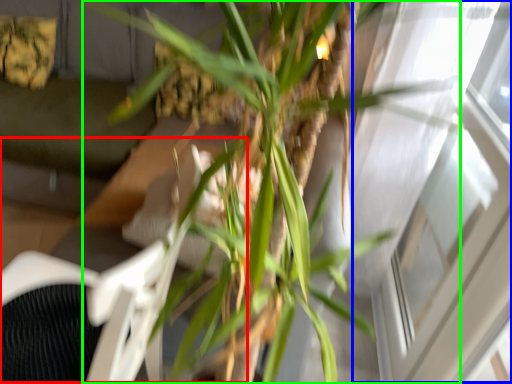
Question: Based on their relative distances, which object is farther from swivel chair (highlighted by a red box)? Choose from window (highlighted by a blue box) and houseplant (highlighted by a green box).

Choices:
 (A) window
 (B) houseplant

Answer: (A)